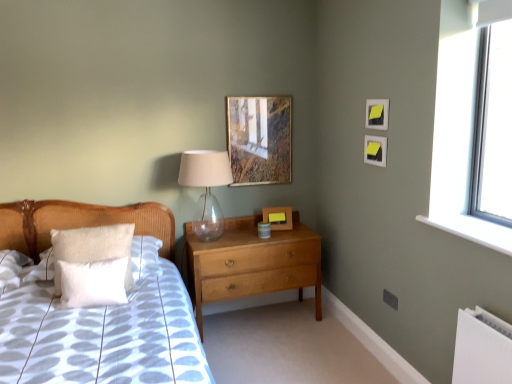
Question: From the image's perspective, is wooden picture frame at upper center, positioned as the 2th picture frame in back-to-front order, positioned above or below matte yellow picture frame at upper right, which is counted as the 2th picture frame, starting from the right?

Choices:
 (A) below
 (B) above

Answer: (A)

Question: Choose the correct answer: Is wooden picture frame at upper center, marked as the 3th picture frame in a front-to-back arrangement, inside matte yellow picture frame at upper right, which is counted as the 2th picture frame, starting from the right, or outside it?

Choices:
 (A) outside
 (B) inside

Answer: (A)

Question: Which is farther from the wooden picture frame at upper center, which is the 1th picture frame from left to right?

Choices:
 (A) transparent glass table lamp at upper center
 (B) white fluffy pillow at left, marked as the second pillow in a back-to-front arrangement
 (C) yellow paper picture frame at upper right, arranged as the 2th picture frame when viewed from the front
 (D) white fabric bed at center
 (E) wooden picture frame at center, positioned as the second picture frame in left-to-right order

Answer: (B)

Question: Estimate the real-world distances between objects in this image. Which object is closer to the transparent plastic window screen at upper right?

Choices:
 (A) light brown wood chest of drawers at center
 (B) matte yellow picture frame at upper right, positioned as the fourth picture frame in back-to-front order
 (C) wooden picture frame at upper center, which is the fourth picture frame from right to left
 (D) white fluffy pillow at left, which ranks as the first pillow in back-to-front order
 (E) yellow paper picture frame at upper right, marked as the 4th picture frame in a left-to-right arrangement

Answer: (B)